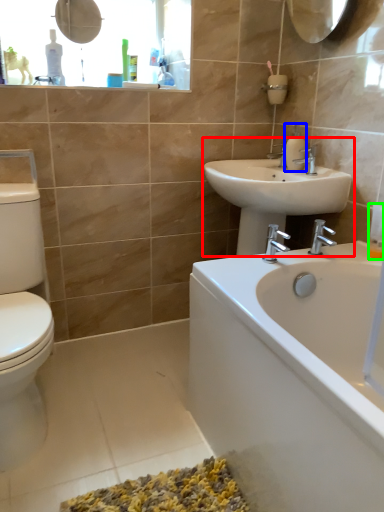
Question: Estimate the real-world distances between objects in this image. Which object is closer to sink (highlighted by a red box), soap dispenser (highlighted by a blue box) or toiletry (highlighted by a green box)?

Choices:
 (A) soap dispenser
 (B) toiletry

Answer: (A)